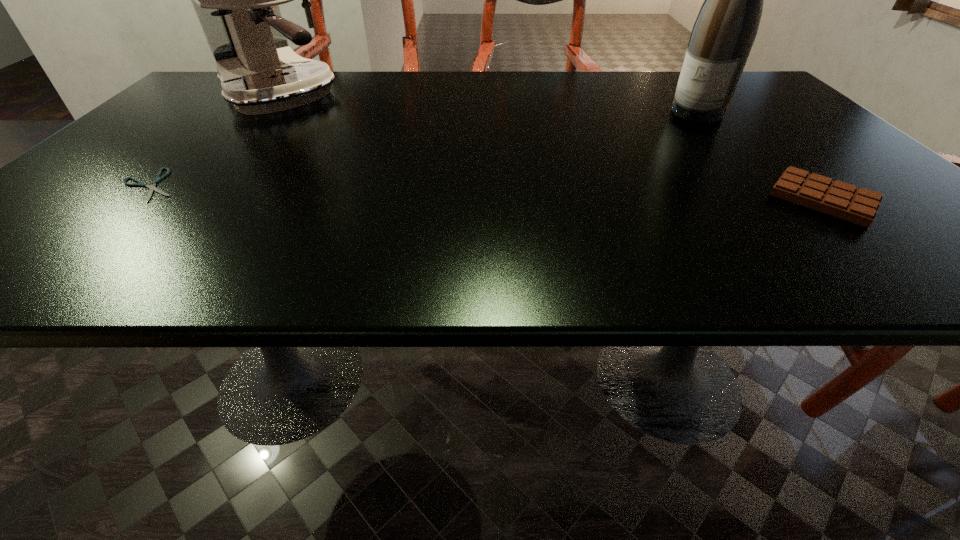
Where is `free space between the wine bottle and the coffee maker`? free space between the wine bottle and the coffee maker is located at coordinates (489, 105).

Identify the location of free space between the shortest object and the wine bottle. The width and height of the screenshot is (960, 540). (423, 149).

Where is `vacant space that's between the coffee maker and the wine bottle`? The image size is (960, 540). vacant space that's between the coffee maker and the wine bottle is located at coordinates (489, 105).

What are the coordinates of `free space that is in between the shortest object and the third tallest object` in the screenshot? It's located at (487, 192).

You are a GUI agent. You are given a task and a screenshot of the screen. Output one action in this format:
    pyautogui.click(x=<x>, y=<y>)
    Task: Click on the vacant region between the shortest object and the candy bar
    
    Given the screenshot: What is the action you would take?
    pyautogui.click(x=487, y=192)

Locate an element on the screen. The height and width of the screenshot is (540, 960). unoccupied area between the third tallest object and the shears is located at coordinates (487, 192).

This screenshot has width=960, height=540. I want to click on object that is the nearest to the wine bottle, so click(836, 198).

Select which object is the second closest to the coffee maker. Please provide its 2D coordinates. Your answer should be formatted as a tuple, i.e. [(x, y)], where the tuple contains the x and y coordinates of a point satisfying the conditions above.

[(722, 37)]

Identify the location of free space that satisfies the following two spatial constraints: 1. on the back side of the shears; 2. on the right side of the coffee maker. (241, 97).

Find the location of a particular element. The height and width of the screenshot is (540, 960). blank area in the image that satisfies the following two spatial constraints: 1. on the front side of the shortest object; 2. on the left side of the second shortest object is located at coordinates (136, 199).